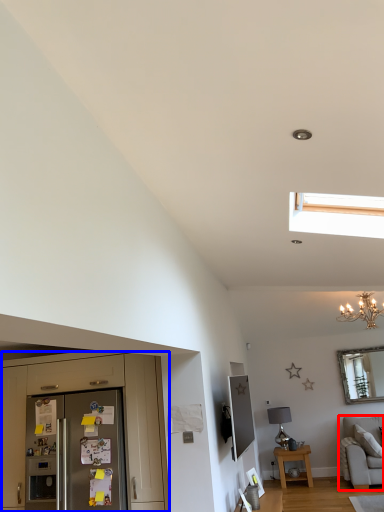
Question: Which object is closer to the camera taking this photo, studio couch (highlighted by a red box) or cabinetry (highlighted by a blue box)?

Choices:
 (A) studio couch
 (B) cabinetry

Answer: (B)